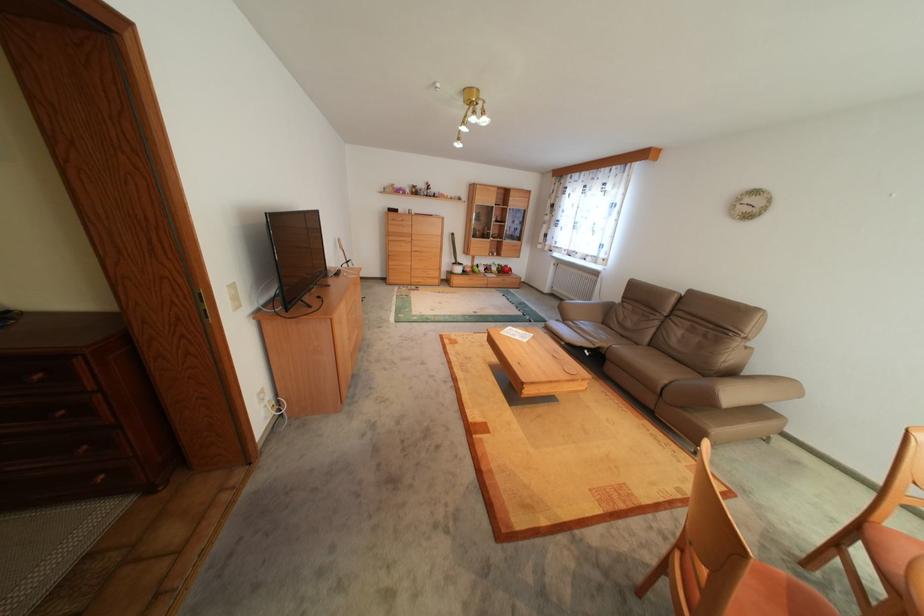
Where would you resting arm the brown sofa armrest? Please return your answer as a coordinate pair (x, y).

(585, 310)